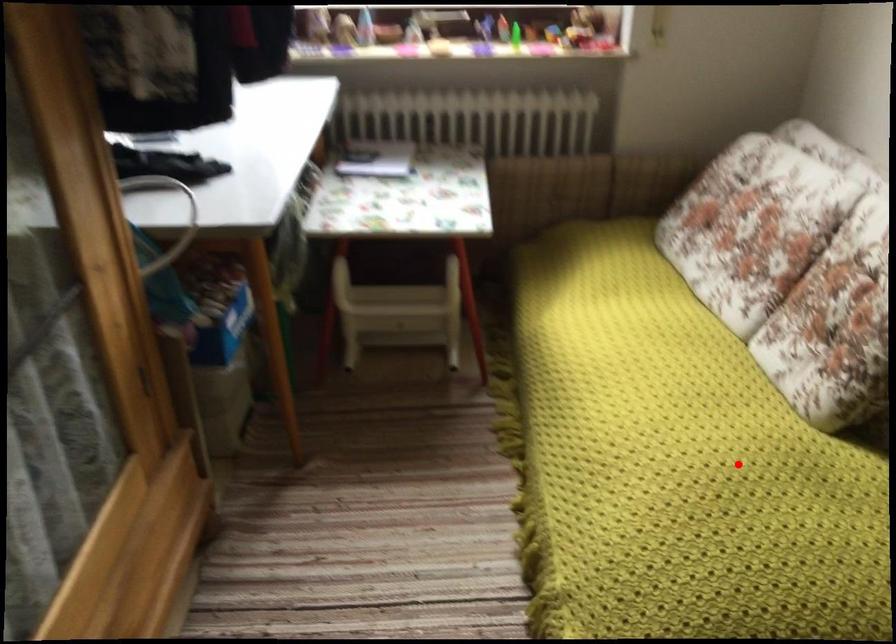
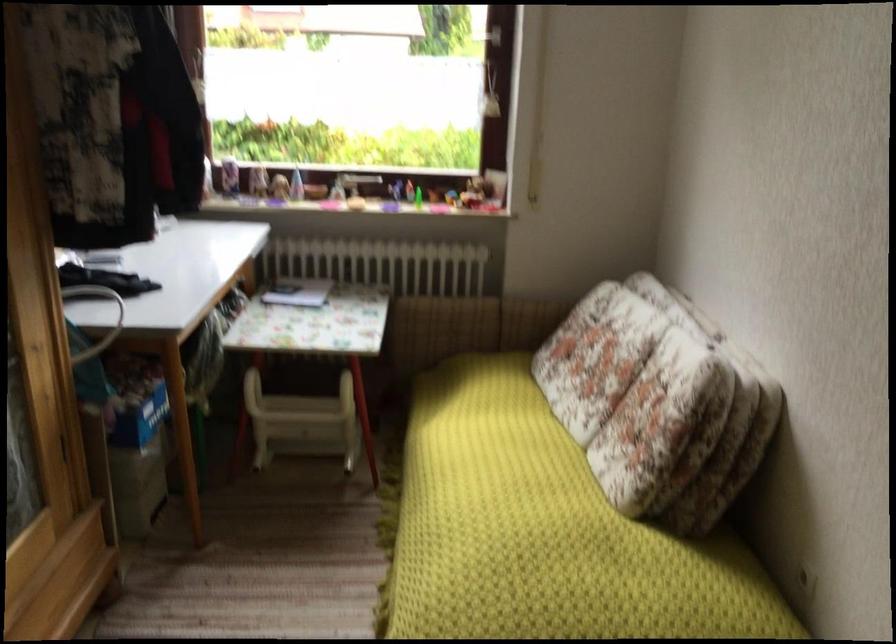
Find the pixel in the second image that matches the highlighted location in the first image.

(544, 532)